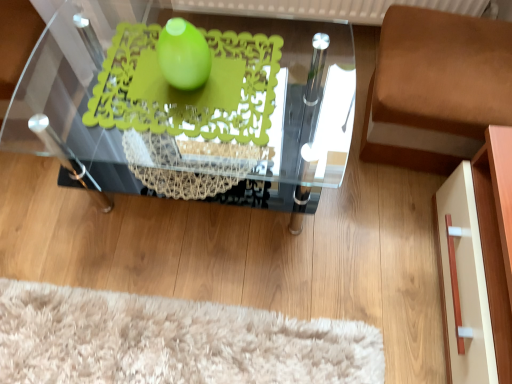
At what (x,y) coordinates should I click in order to perform the action: click on free space above green matte doily at center (from a real-world perspective). Please return your answer as a coordinate pair (x, y). Looking at the image, I should click on (193, 90).